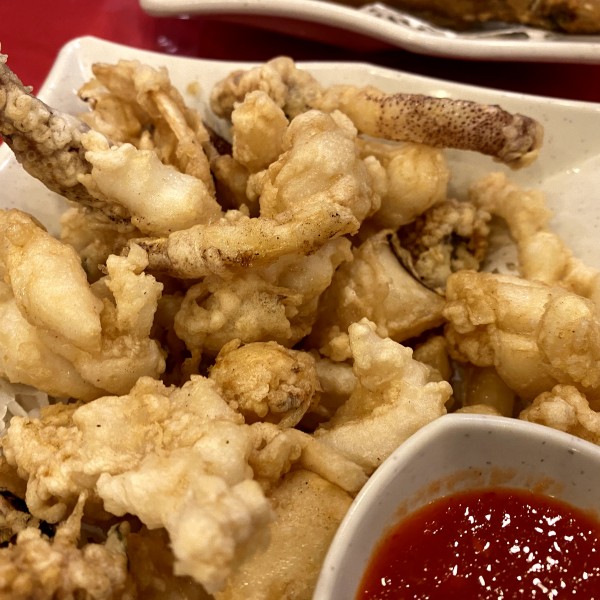
Where is `plate`? This screenshot has width=600, height=600. plate is located at coordinates click(560, 127).